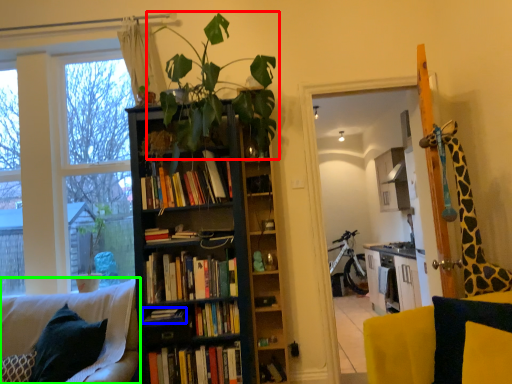
Question: Considering the real-world distances, which object is farthest from houseplant (highlighted by a red box)? book (highlighted by a blue box) or chair (highlighted by a green box)?

Choices:
 (A) book
 (B) chair

Answer: (A)